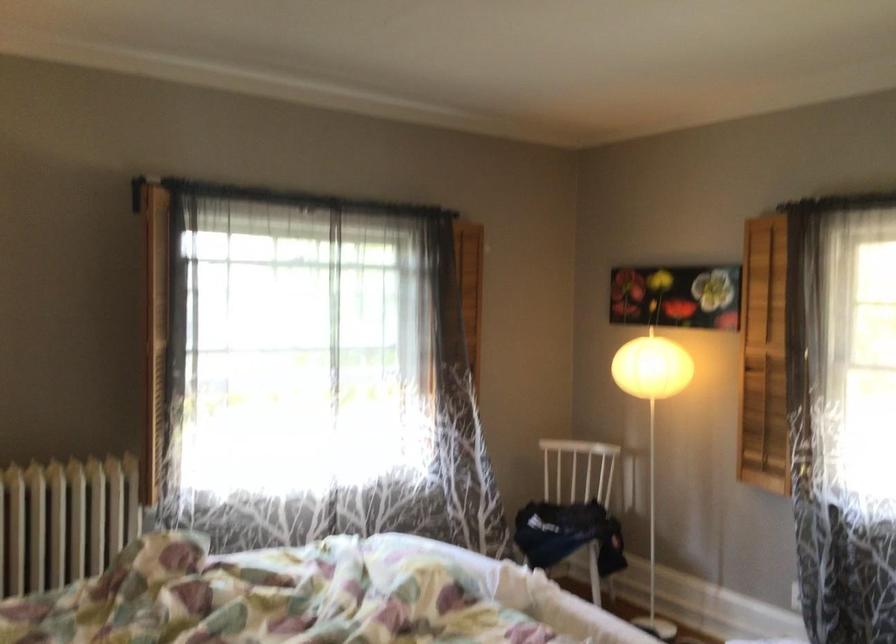
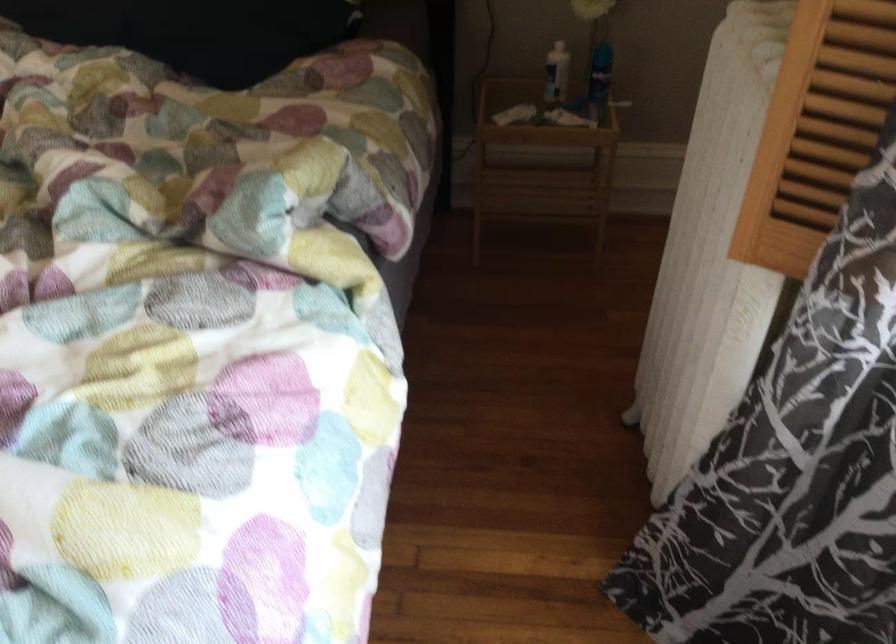
The point at (156, 450) is marked in the first image. Where is the corresponding point in the second image?

(815, 129)